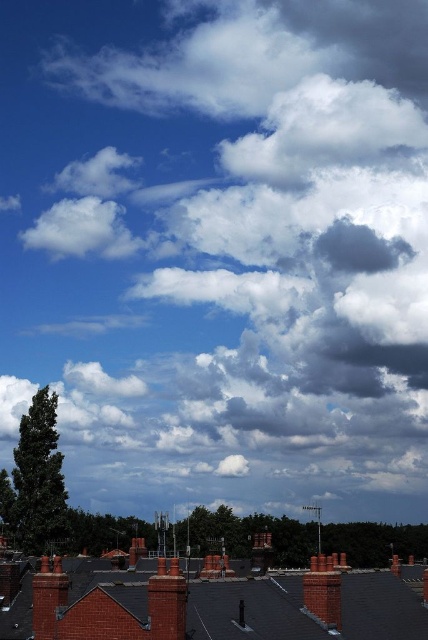
Question: Does brick chimney at center appear on the right side of red brick chimney at lower left?

Choices:
 (A) yes
 (B) no

Answer: (A)

Question: Which object is closer to the camera taking this photo?

Choices:
 (A) red brick chimney at lower left
 (B) red brick chimney at center
 (C) brick chimney at center

Answer: (B)

Question: In this image, where is red brick roof at lower left located relative to red brick chimney at center?

Choices:
 (A) right
 (B) left

Answer: (A)

Question: Which point is closer to the camera?

Choices:
 (A) (127, 584)
 (B) (171, 637)
 (C) (323, 568)
 (D) (47, 616)

Answer: (B)

Question: Can you confirm if brick chimney at center is bigger than red brick chimney at lower left?

Choices:
 (A) yes
 (B) no

Answer: (B)

Question: Which point appears closest to the camera in this image?

Choices:
 (A) (326, 561)
 (B) (130, 588)

Answer: (B)